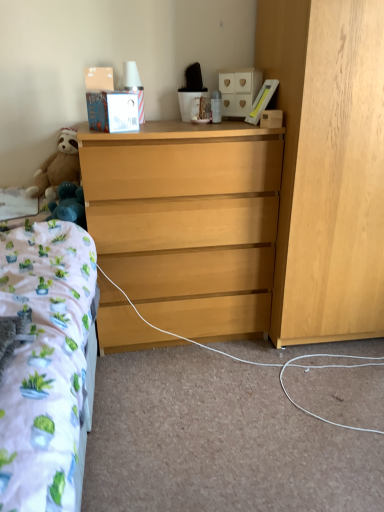
Locate an element on the screen. This screenshot has height=512, width=384. free space in front of light wood dresser at center is located at coordinates (194, 403).